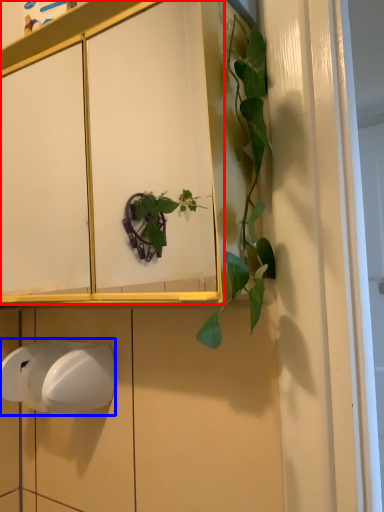
Question: Among these objects, which one is nearest to the camera, cabinetry (highlighted by a red box) or hand dryer (highlighted by a blue box)?

Choices:
 (A) cabinetry
 (B) hand dryer

Answer: (A)